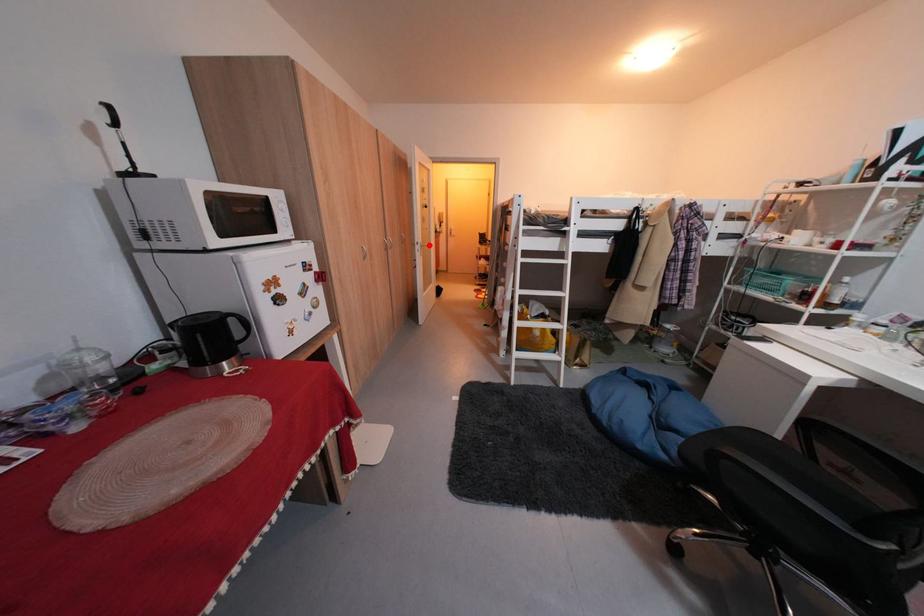
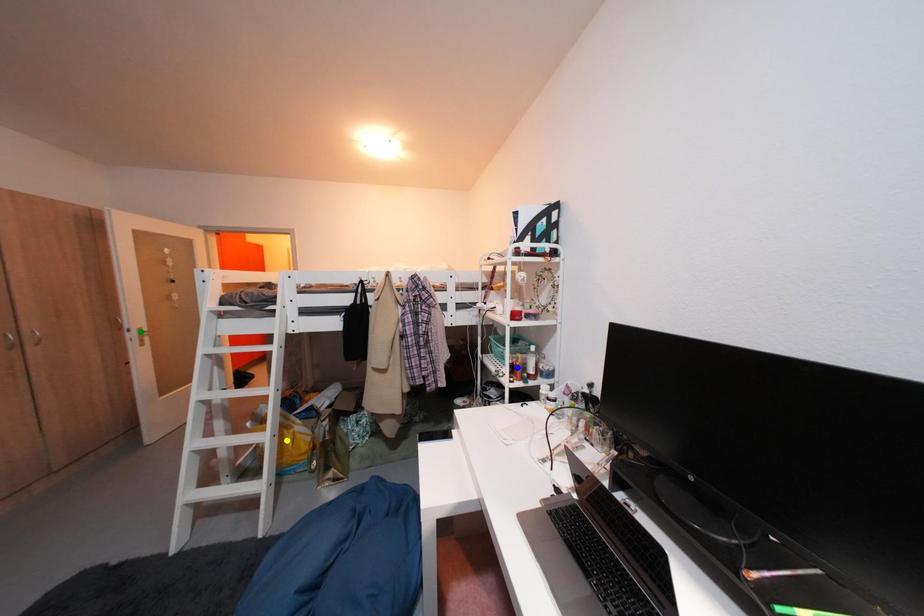
Question: I am providing you with two images of the same scene from different viewpoints. A red point is marked on the first image. You are given multiple points on the second image. In image 2, which mark is for the same physical point as the one in image 1?

Choices:
 (A) yellow point
 (B) green point
 (C) blue point

Answer: (B)